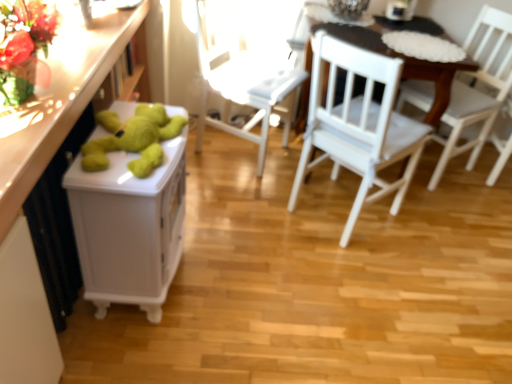
At what (x,y) coordinates should I click in order to perform the action: click on free spot above green plush bear at left (from a real-world perspective). Please return your answer as a coordinate pair (x, y). This screenshot has width=512, height=384. Looking at the image, I should click on pos(119,143).